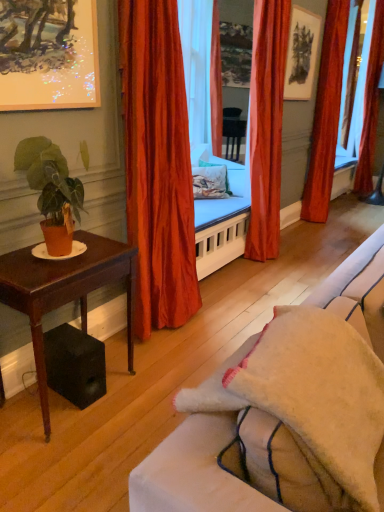
This screenshot has width=384, height=512. I want to click on empty space that is to the right of mahogany wood side table at left, so click(150, 389).